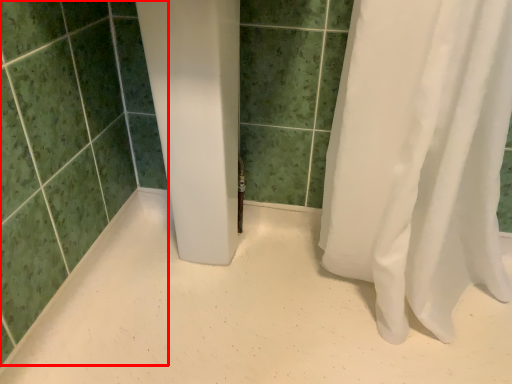
Question: From the image's perspective, where is ceramic tile (annotated by the red box) located relative to plain?

Choices:
 (A) below
 (B) above

Answer: (B)